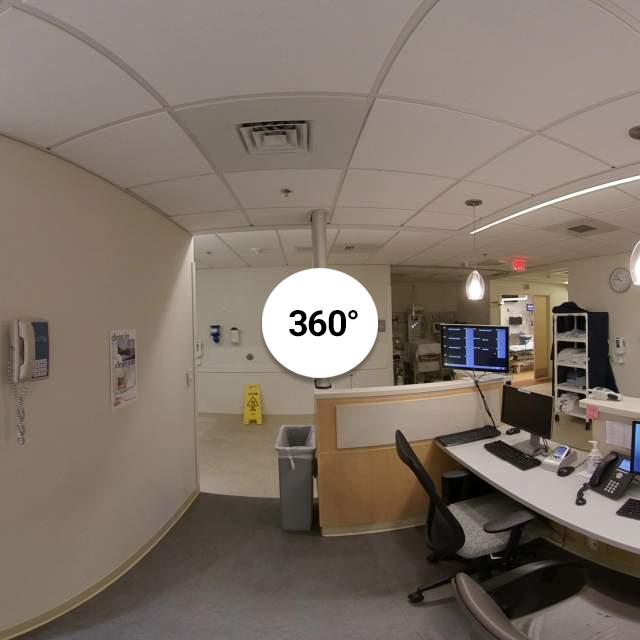
Identify the location of computer monitor. This screenshot has width=640, height=640. (468, 344), (513, 403), (634, 445).